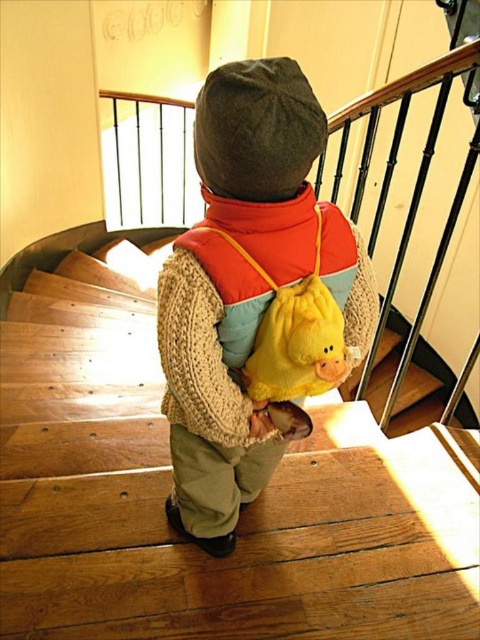
Question: Which point is closer to the camera taking this photo?

Choices:
 (A) [x=259, y=401]
 (B) [x=146, y=484]
 (C) [x=218, y=426]

Answer: (C)

Question: Does wooden stairs at center appear under wooden at center?

Choices:
 (A) no
 (B) yes

Answer: (A)

Question: Estimate the real-world distances between objects in this image. Which object is closer to the yellow plush backpack at center?

Choices:
 (A) knitted wool sweater at center
 (B) wooden at center
 (C) wooden stairs at center

Answer: (A)

Question: From the image, what is the correct spatial relationship of wooden stairs at center in relation to knitted wool sweater at center?

Choices:
 (A) left
 (B) right

Answer: (A)

Question: Estimate the real-world distances between objects in this image. Which object is closer to the yellow plush backpack at center?

Choices:
 (A) knitted wool sweater at center
 (B) wooden at center
 (C) wooden stairs at center

Answer: (A)

Question: Can you confirm if wooden stairs at center is wider than wooden at center?

Choices:
 (A) yes
 (B) no

Answer: (A)